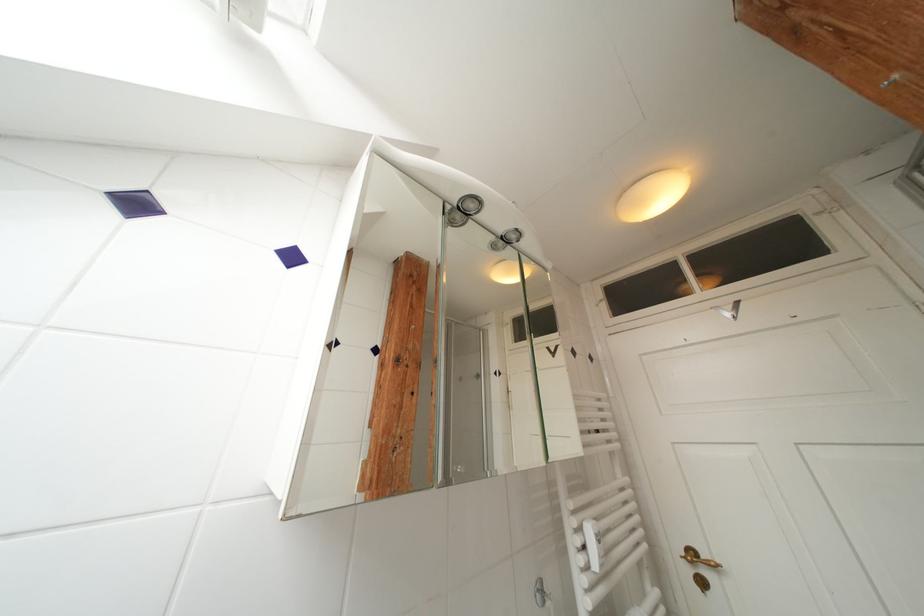
Find the location of `brass door handle`. brass door handle is located at coordinates (698, 557).